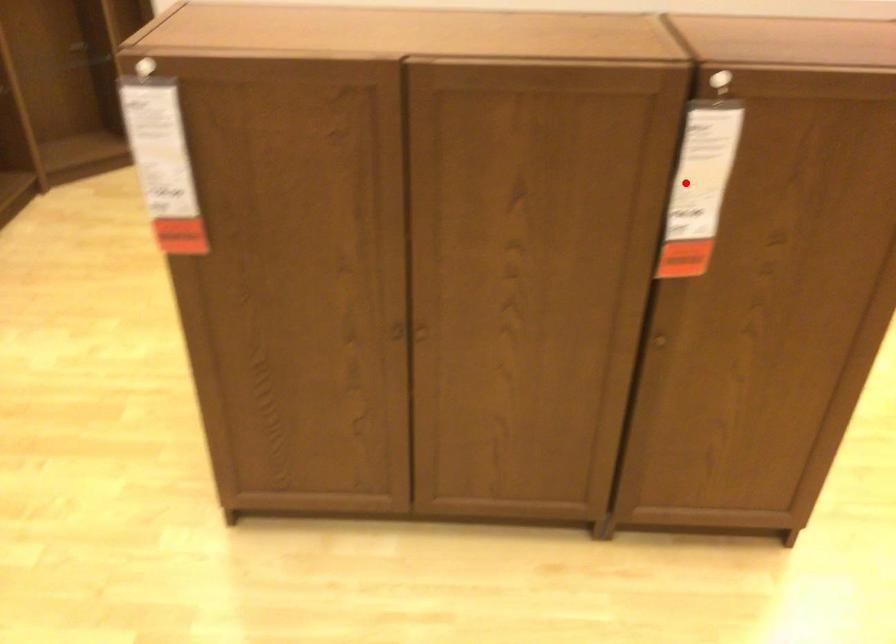
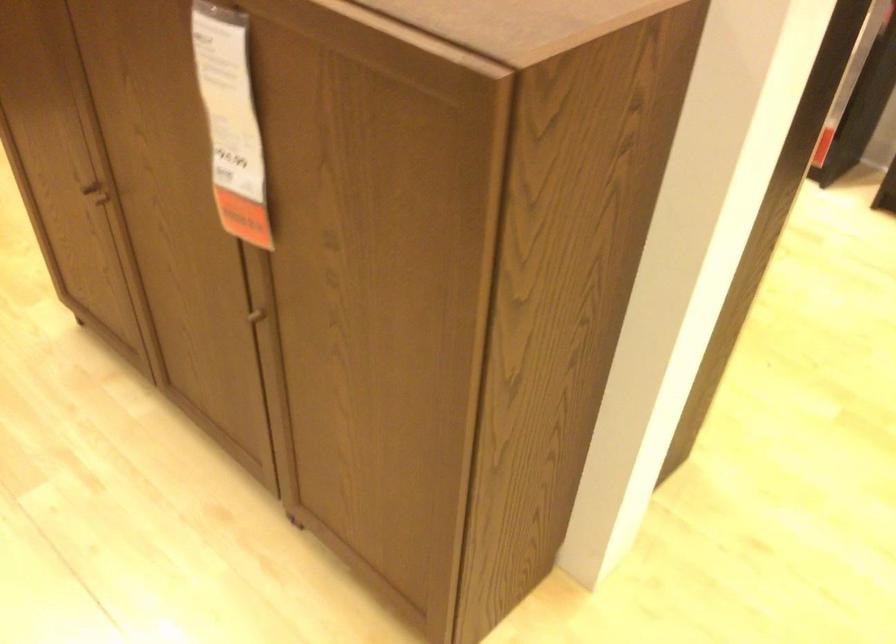
Question: I am providing you with two images of the same scene from different viewpoints. Image1 has a red point marked. In image2, the corresponding 3D location appears at what relative position? Reply with the corresponding letter.

Choices:
 (A) Closer
 (B) Farther

Answer: (A)